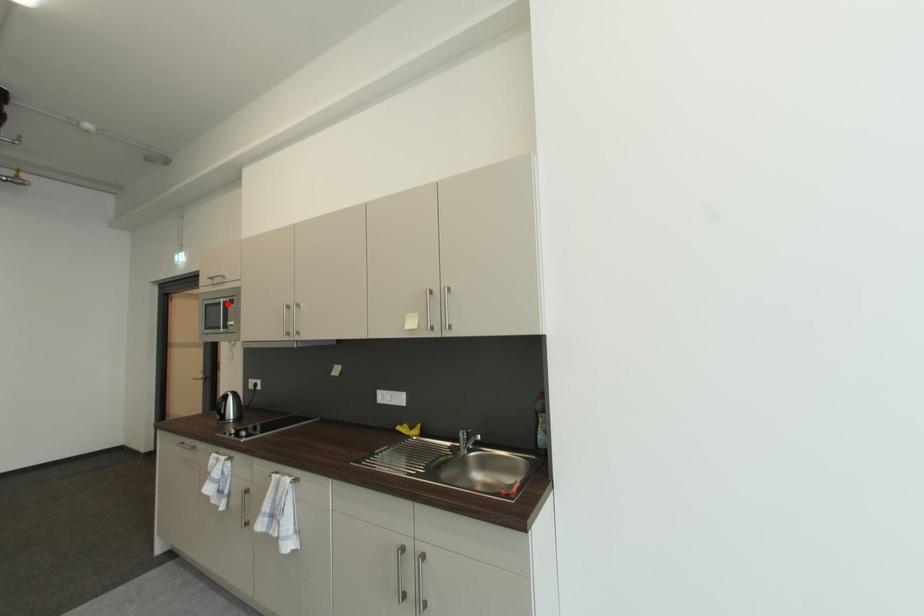
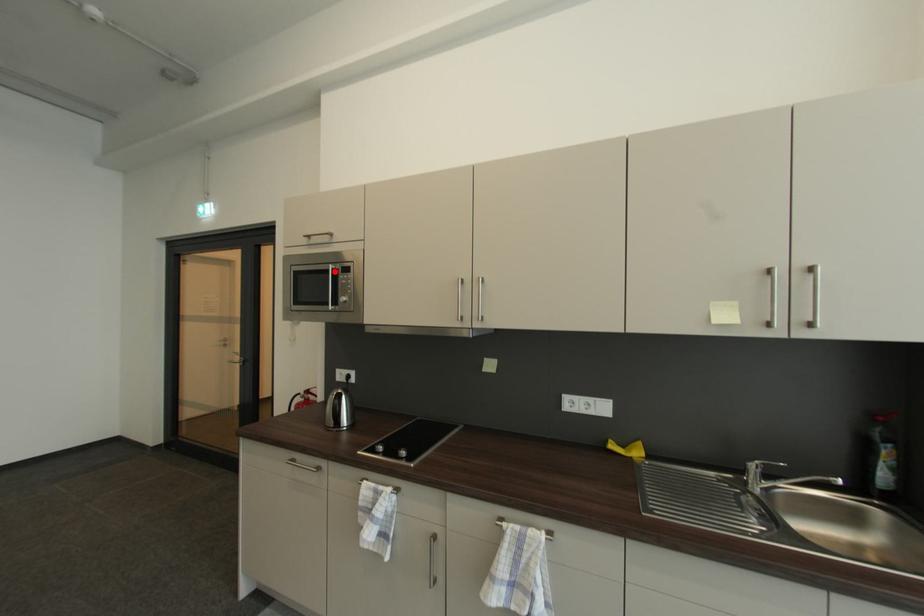
From the picture: I am providing you with two images of the same scene from different viewpoints. A red point is marked on the first image and another point is marked on the second image. Are the points marked in image1 and image2 representing the same 3D position?

Yes